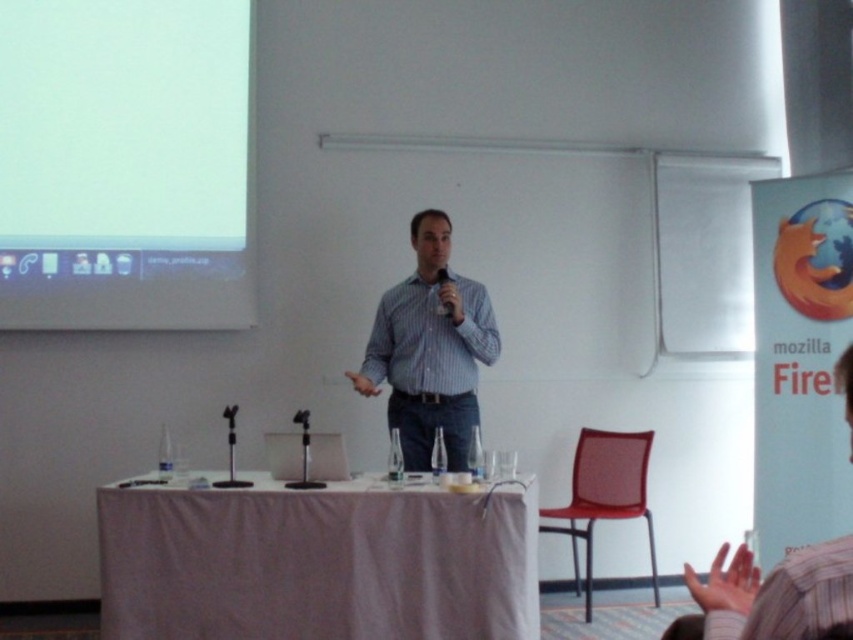
Question: Does blue striped shirt at center have a lesser width compared to red mesh chair at lower right?

Choices:
 (A) no
 (B) yes

Answer: (A)

Question: Among these points, which one is nearest to the camera?

Choices:
 (A) (640, 474)
 (B) (444, 307)

Answer: (B)

Question: Considering the relative positions of white fabric table at lower center and blue striped shirt at center in the image provided, where is white fabric table at lower center located with respect to blue striped shirt at center?

Choices:
 (A) left
 (B) right

Answer: (A)

Question: Can you confirm if blue striped shirt at center is positioned to the left of red mesh chair at lower right?

Choices:
 (A) no
 (B) yes

Answer: (B)

Question: Which object is positioned closest to the white fabric table at lower center?

Choices:
 (A) red mesh chair at lower right
 (B) white glossy projection screen at upper left

Answer: (A)

Question: Which point is closer to the camera?

Choices:
 (A) (426, 289)
 (B) (822, 616)
 (C) (141, 232)
 (D) (624, 516)

Answer: (B)